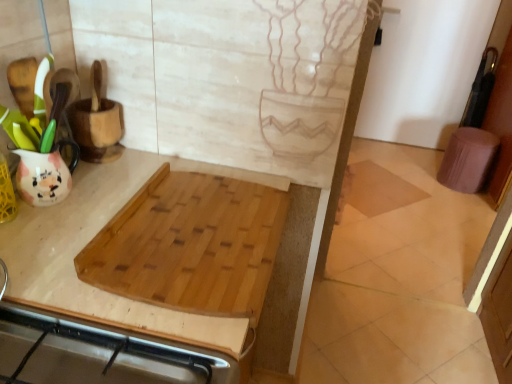
Question: Would you say natural wood cutting board at center is to the left or to the right of beige tile at center in the picture?

Choices:
 (A) left
 (B) right

Answer: (A)

Question: Looking at their shapes, would you say natural wood cutting board at center is wider or thinner than beige tile at center?

Choices:
 (A) thin
 (B) wide

Answer: (A)

Question: Which object is positioned farthest from the natural wood cutting board at center?

Choices:
 (A) purple fabric step stool at right
 (B) natural wood cutting board at upper left
 (C) beige tile at center

Answer: (A)

Question: Which of these objects is positioned closest to the natural wood cutting board at upper left?

Choices:
 (A) purple fabric step stool at right
 (B) natural wood cutting board at center
 (C) beige tile at center

Answer: (B)